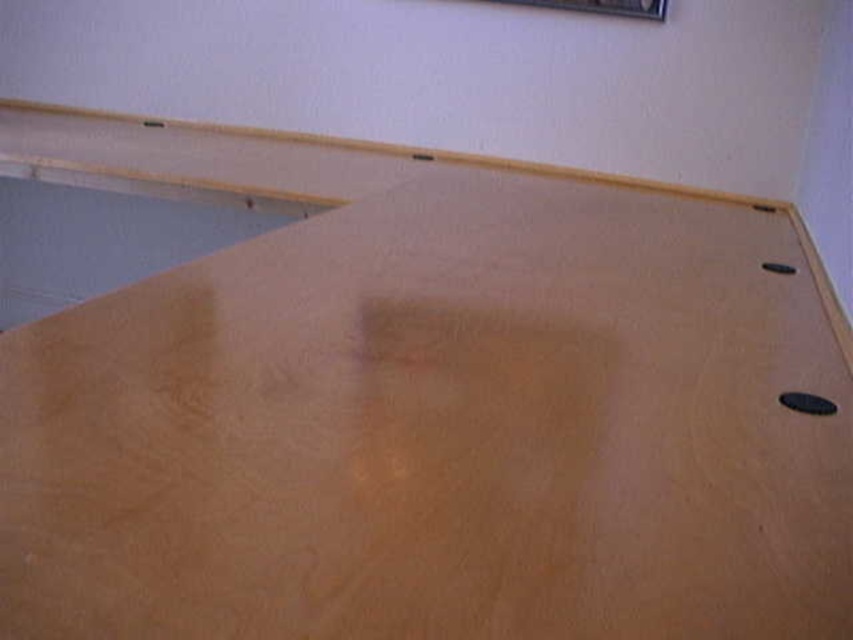
Can you confirm if light brown wood table at upper center is positioned to the right of metallic silver picture frame at upper center?

No, light brown wood table at upper center is not to the right of metallic silver picture frame at upper center.

Is light brown wood table at upper center wider than metallic silver picture frame at upper center?

Correct, the width of light brown wood table at upper center exceeds that of metallic silver picture frame at upper center.

Which is behind, point (93, 307) or point (657, 19)?

Positioned behind is point (657, 19).

Find the location of a particular element. light brown wood table at upper center is located at coordinates (439, 429).